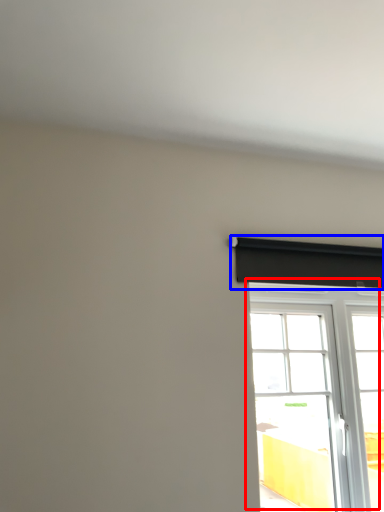
Question: Which object is closer to the camera taking this photo, window (highlighted by a red box) or curtain (highlighted by a blue box)?

Choices:
 (A) window
 (B) curtain

Answer: (A)